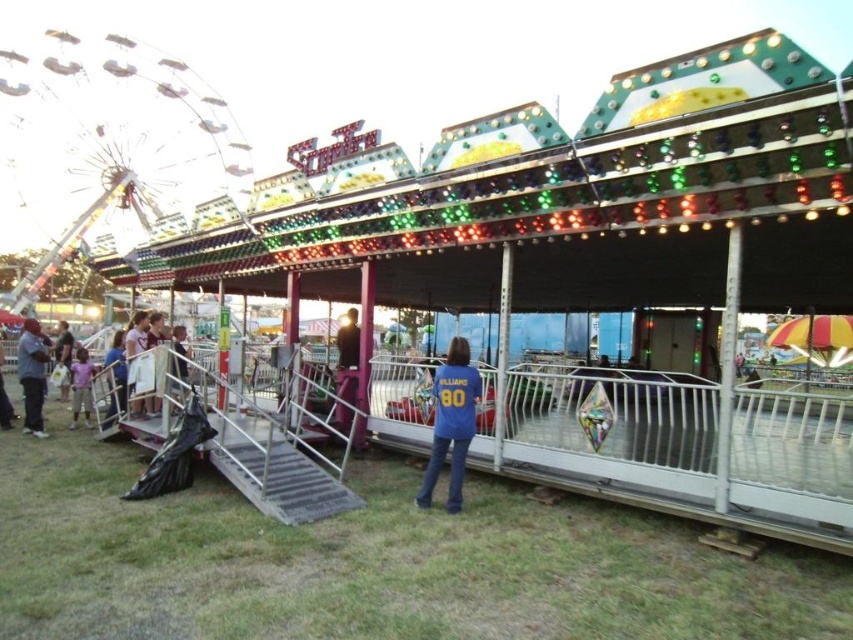
Question: Estimate the real-world distances between objects in this image. Which object is farther from the light purple shirt at lower left?

Choices:
 (A) blue denim jacket at center
 (B) dark blue jeans at left

Answer: (A)

Question: Can you confirm if blue jersey at center is wider than blue denim jacket at center?

Choices:
 (A) yes
 (B) no

Answer: (B)

Question: In this image, where is dark blue jeans at left located relative to light purple shirt at lower left?

Choices:
 (A) above
 (B) below

Answer: (B)

Question: Which object is positioned closest to the light purple shirt at lower left?

Choices:
 (A) blue jersey at center
 (B) dark blue jeans at left
 (C) blue denim jacket at center

Answer: (B)

Question: Is blue jersey at center bigger than dark blue jeans at left?

Choices:
 (A) no
 (B) yes

Answer: (A)

Question: Which is nearer to the blue jersey at center?

Choices:
 (A) dark blue jeans at left
 (B) light purple shirt at lower left
 (C) blue denim jacket at center

Answer: (C)